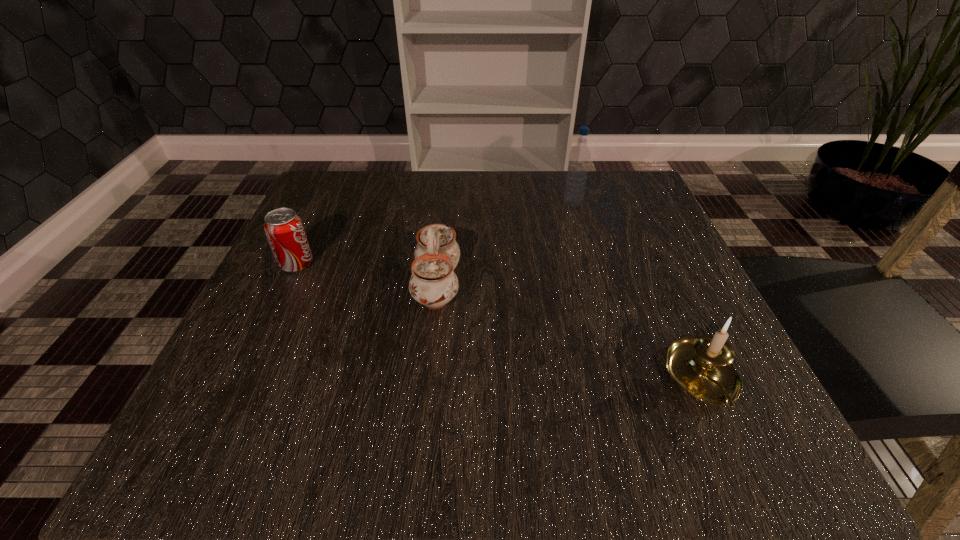
Image resolution: width=960 pixels, height=540 pixels. Identify the location of the farthest object. (579, 157).

The height and width of the screenshot is (540, 960). In order to click on the tallest object in this screenshot , I will do `click(579, 157)`.

The height and width of the screenshot is (540, 960). I want to click on chinaware, so click(x=433, y=283).

Locate an element on the screen. The image size is (960, 540). candle holder is located at coordinates click(703, 366).

Identify the location of the nearest object. This screenshot has height=540, width=960. (703, 366).

The height and width of the screenshot is (540, 960). In order to click on soda in this screenshot , I will do `click(285, 232)`.

Locate an element on the screen. This screenshot has height=540, width=960. free space located on the back of the water bottle is located at coordinates (564, 176).

The width and height of the screenshot is (960, 540). I want to click on vacant space situated by the handle of the chinaware, so point(557,285).

This screenshot has height=540, width=960. What are the coordinates of `vacant space located on the right of the leftmost object` in the screenshot? It's located at (433, 264).

You are a GUI agent. You are given a task and a screenshot of the screen. Output one action in this format:
    pyautogui.click(x=<x>, y=<y>)
    Task: Click on the object that is positioned at the far edge
    
    Given the screenshot: What is the action you would take?
    pyautogui.click(x=579, y=157)